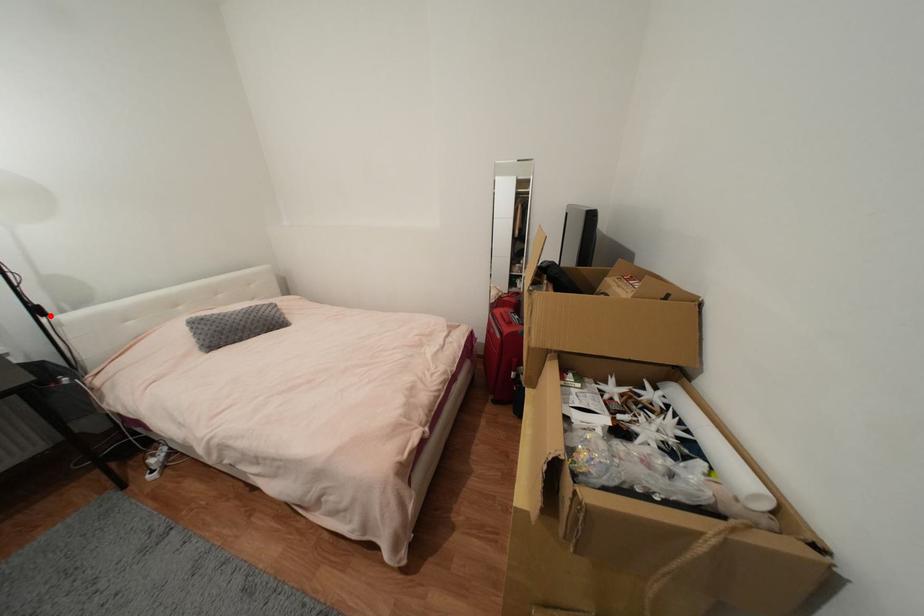
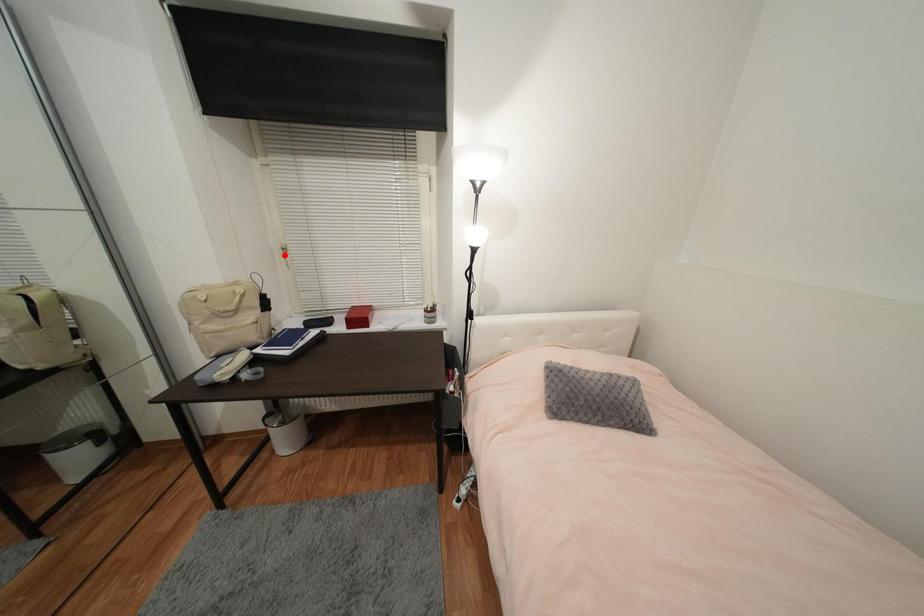
I am providing you with two images of the same scene from different viewpoints. A red point is marked on the first image and another point is marked on the second image. Is the marked point in image1 the same physical position as the marked point in image2?

No